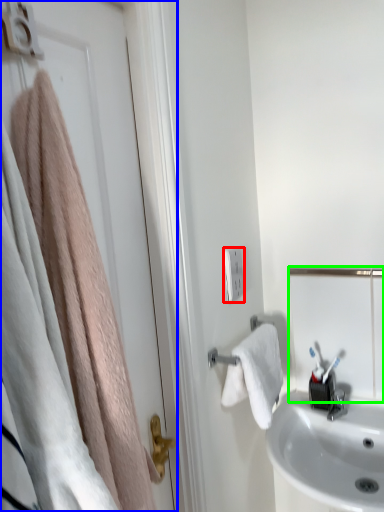
Question: Estimate the real-world distances between objects in this image. Which object is farther from light switch (highlighted by a red box), door (highlighted by a blue box) or mirror (highlighted by a green box)?

Choices:
 (A) door
 (B) mirror

Answer: (A)